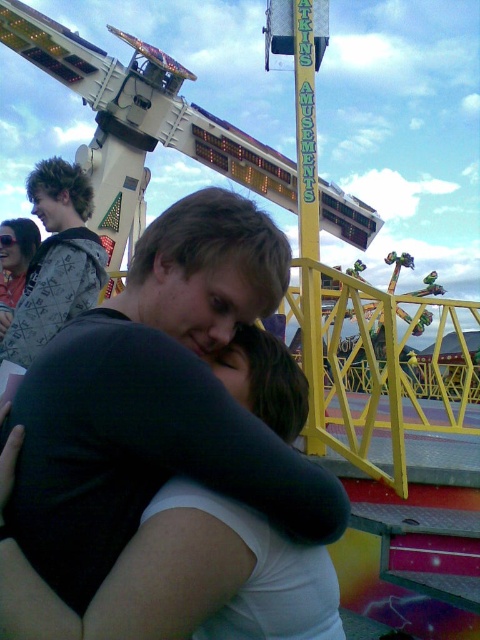
You are standing at the origin point in the image. Which direction should you move to reach the black matte shirt at center?

The black matte shirt at center is located at coordinates approximately 0.419 on the x and 0.427 on the y axis. Since you are at the origin point, you should move towards the northeast direction to reach it.

You are a photographer at the fairground. You need to capture a photo where the black matte shirt at center and the sweater at upper left are both visible. Which object will appear larger in the photo?

The black matte shirt at center will appear larger in the photo because it is closer to the viewer than the sweater at upper left.

You are at the fairground and see the black matte shirt at center and the sweater at upper left. Which piece of clothing is positioned to the right of the other?

The black matte shirt at center is to the right of the sweater at upper left.